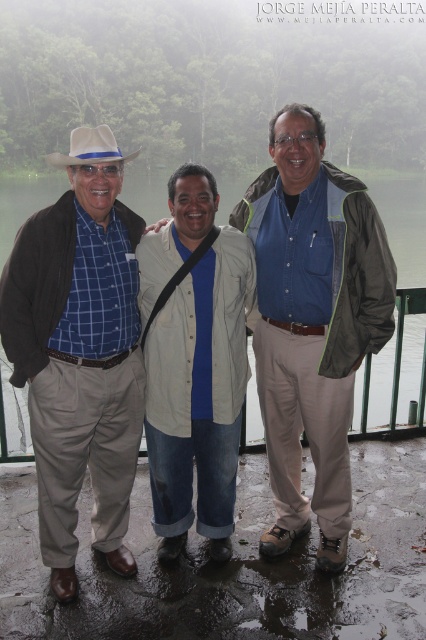
You are a photographer setting up for a group photo. You need to ensure that the matte blue plaid shirt at center and the white felt cowboy hat at upper left are both in focus. Which object should you focus on first to ensure depth of field captures both?

You should focus on the matte blue plaid shirt at center first since it is closer to the viewer than the white felt cowboy hat at upper left, allowing the depth of field to extend backward to include both objects.

Based on the photo, you are standing at the point marked as point (183, 253) and want to walk to the nearest tree. The nearest tree is 4 meters away from you. Can you reach the tree without crossing the paved area?

The distance between you and the viewer is 3.42 meters, which is less than the 4 meters to the nearest tree. Therefore, you can reach the tree without crossing the paved area.

You are a photographer holding a camera. You want to take a photo of the beige cotton shirt at center without moving the shirt. Can you do so while staying where you are?

The beige cotton shirt at center and camera are 3.27 meters apart, so yes, you can take a photo of the beige cotton shirt at center from your current position as the distance is sufficient.